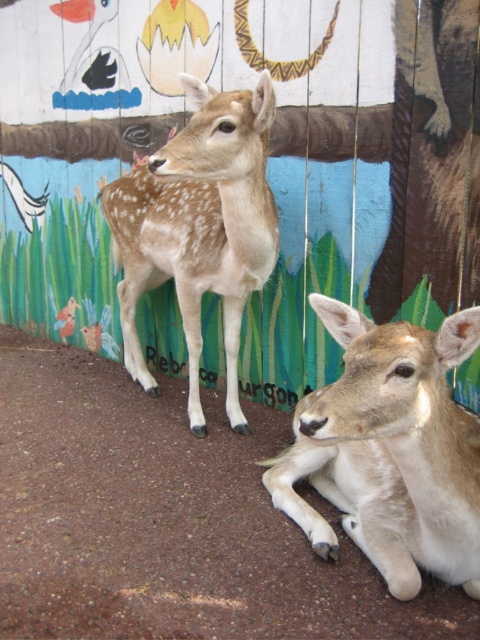
Question: Among these objects, which one is farthest from the camera?

Choices:
 (A) spotted fur deer at center
 (B) light brown fur at center

Answer: (A)

Question: Is light brown fur at center below spotted fur deer at center?

Choices:
 (A) no
 (B) yes

Answer: (B)

Question: Is light brown fur at center thinner than spotted fur deer at center?

Choices:
 (A) no
 (B) yes

Answer: (B)

Question: Which point appears farthest from the camera in this image?

Choices:
 (A) (253, 289)
 (B) (459, 353)

Answer: (A)

Question: Does light brown fur at center appear on the left side of spotted fur deer at center?

Choices:
 (A) no
 (B) yes

Answer: (A)